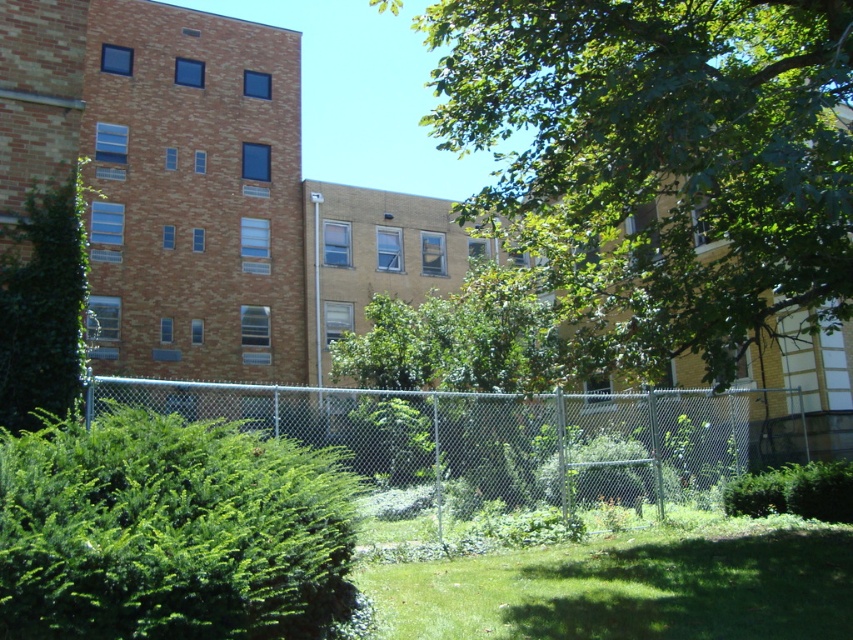
Question: Is green leafy bush at lower left thinner than silver chain-link fence at center?

Choices:
 (A) no
 (B) yes

Answer: (B)

Question: In this image, where is green leafy bush at left located relative to green leafy hedge at lower right?

Choices:
 (A) left
 (B) right

Answer: (A)

Question: Does green leafy bush at lower left lie in front of green grass at lower center?

Choices:
 (A) no
 (B) yes

Answer: (B)

Question: Which point is closer to the camera?

Choices:
 (A) green leafy bush at left
 (B) green leafy tree at upper center
 (C) silver chain-link fence at center
 (D) green leafy hedge at lower right

Answer: (B)

Question: Estimate the real-world distances between objects in this image. Which object is farther from the green leafy bush at lower left?

Choices:
 (A) silver chain-link fence at center
 (B) green leafy hedge at lower right

Answer: (B)

Question: Estimate the real-world distances between objects in this image. Which object is farther from the green leafy tree at upper center?

Choices:
 (A) green leafy bush at lower left
 (B) green leafy hedge at lower right

Answer: (A)